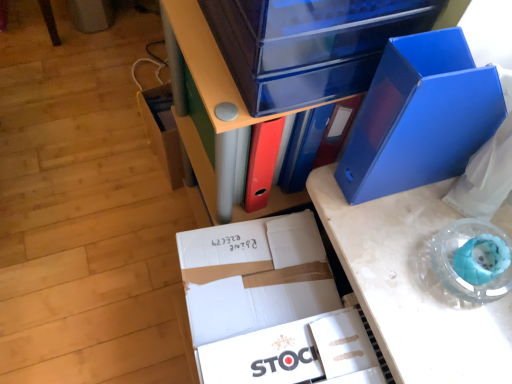
You are a GUI agent. You are given a task and a screenshot of the screen. Output one action in this format:
    pyautogui.click(x=<x>, y=<y>)
    Task: Click on the free spot above white cardboard box at center (from a real-world perspective)
    The width and height of the screenshot is (512, 384).
    Given the screenshot: What is the action you would take?
    pyautogui.click(x=260, y=264)